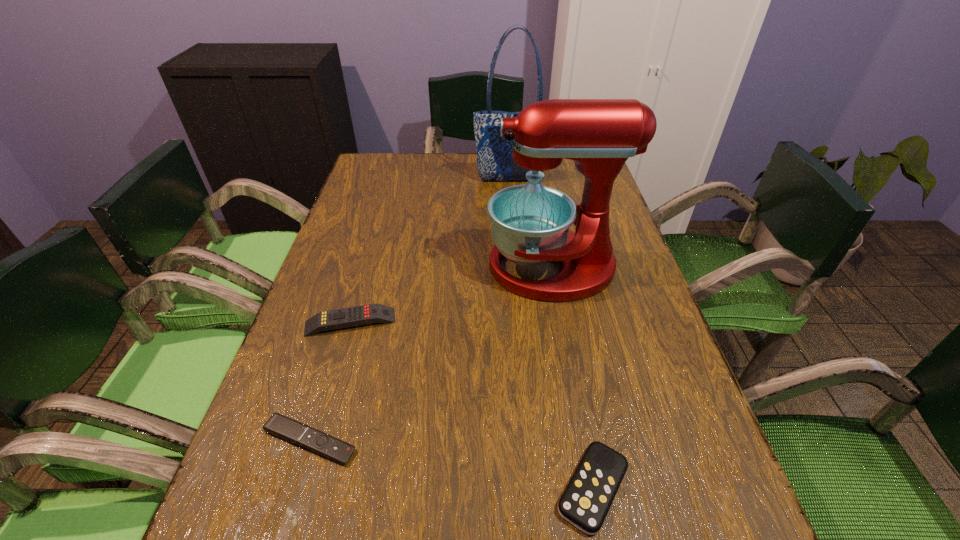
The height and width of the screenshot is (540, 960). What are the coordinates of `the farthest object` in the screenshot? It's located at (495, 162).

Locate an element on the screen. The image size is (960, 540). the fourth nearest object is located at coordinates (530, 223).

This screenshot has height=540, width=960. In order to click on the third farthest object in this screenshot , I will do `click(372, 313)`.

The image size is (960, 540). I want to click on the second shortest remote control, so click(x=585, y=503).

Where is `the rightmost remote control`? the rightmost remote control is located at coordinates (585, 503).

The image size is (960, 540). I want to click on the shortest object, so click(278, 425).

This screenshot has height=540, width=960. In order to click on blank space located on the front-facing side of the shopping bag in this screenshot , I will do `click(513, 200)`.

What are the coordinates of `free space located 0.110m on the front-facing side of the second farthest object` in the screenshot? It's located at 442,267.

Where is `vacant space located 0.320m on the front-facing side of the second farthest object`? This screenshot has width=960, height=540. vacant space located 0.320m on the front-facing side of the second farthest object is located at coordinates (356, 267).

Identify the location of vacant region located 0.320m on the front-facing side of the second farthest object. The width and height of the screenshot is (960, 540). [356, 267].